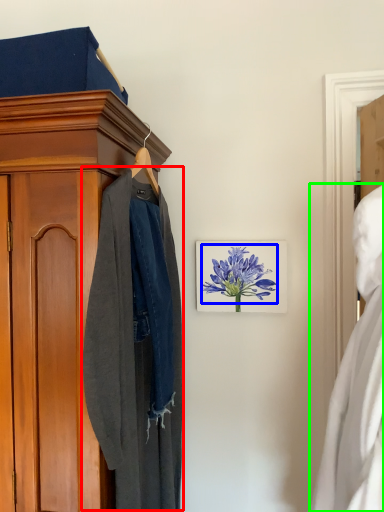
Question: Which object is positioned farthest from clothing (highlighted by a red box)? Select from flower (highlighted by a blue box) and dress (highlighted by a green box).

Choices:
 (A) flower
 (B) dress

Answer: (B)